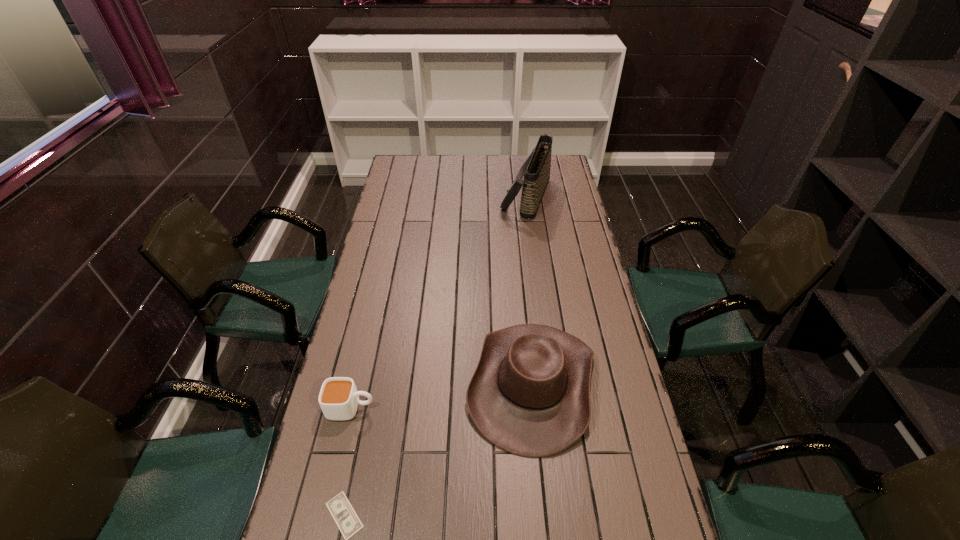
You are a GUI agent. You are given a task and a screenshot of the screen. Output one action in this format:
    pyautogui.click(x=<x>, y=<y>)
    Task: Click on the farthest object
    The image size is (960, 540).
    Given the screenshot: What is the action you would take?
    pyautogui.click(x=536, y=170)

The width and height of the screenshot is (960, 540). In order to click on the tallest object in this screenshot , I will do `click(536, 170)`.

Locate an element on the screen. This screenshot has width=960, height=540. cowboy hat is located at coordinates (530, 393).

You are a GUI agent. You are given a task and a screenshot of the screen. Output one action in this format:
    pyautogui.click(x=<x>, y=<y>)
    Task: Click on the second shortest object
    The width and height of the screenshot is (960, 540).
    Given the screenshot: What is the action you would take?
    pyautogui.click(x=339, y=398)

You are a GUI agent. You are given a task and a screenshot of the screen. Output one action in this format:
    pyautogui.click(x=<x>, y=<y>)
    Task: Click on the free region located on the back of the handbag
    The image size is (960, 540).
    Given the screenshot: What is the action you would take?
    (x=521, y=163)

At what (x,y) coordinates should I click in order to perform the action: click on free region located on the back of the third shortest object. Please return your answer as a coordinate pair (x, y). Image resolution: width=960 pixels, height=540 pixels. Looking at the image, I should click on (524, 295).

What are the coordinates of `vacant area situated on the side with the handle of the second shortest object` in the screenshot? It's located at (420, 408).

What are the coordinates of `object positioned at the far edge` in the screenshot? It's located at (536, 170).

Find the location of a particular element. Image resolution: width=960 pixels, height=540 pixels. object situated at the left edge is located at coordinates (339, 398).

Locate an element on the screen. The image size is (960, 540). handbag that is at the right edge is located at coordinates (536, 170).